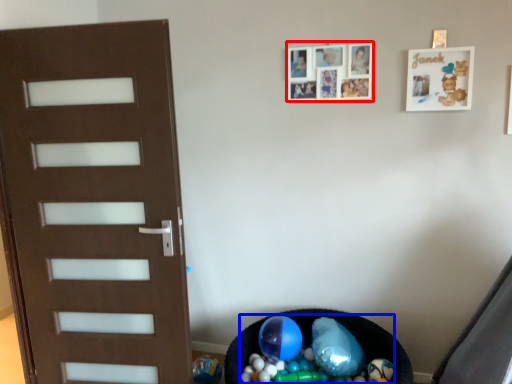
Question: Which object appears farthest to the camera in this image, picture frame (highlighted by a red box) or garbage (highlighted by a blue box)?

Choices:
 (A) picture frame
 (B) garbage

Answer: (A)